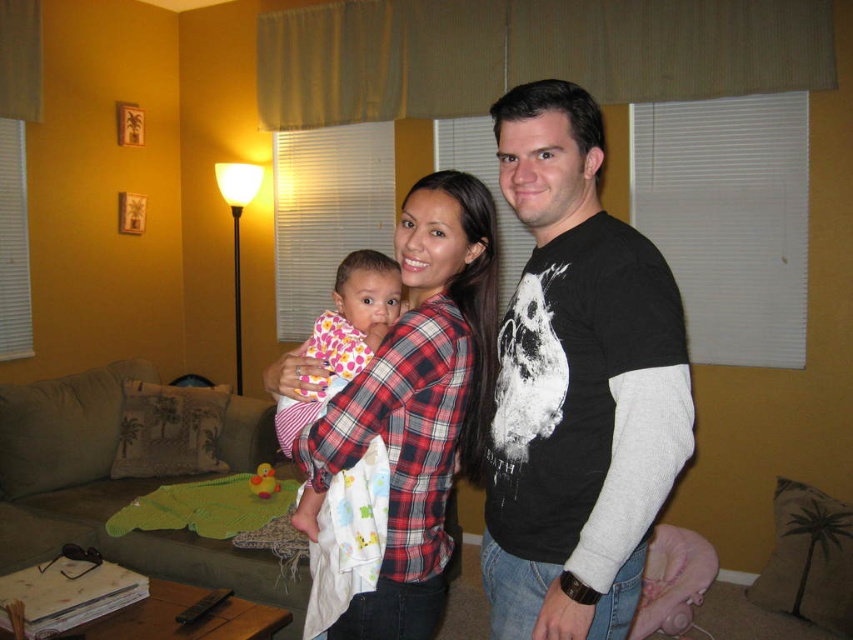
You are taking a photo of the scene and want to focus on both the woman holding the baby and the floor lamp. The woman is at point (x=514, y=368) and the floor lamp is at point (x=296, y=509). Which point should you adjust your focus to first to ensure both are in focus?

Point (x=514, y=368) is closer to the camera than point (x=296, y=509), so you should focus on the woman holding the baby first to ensure both are in focus.